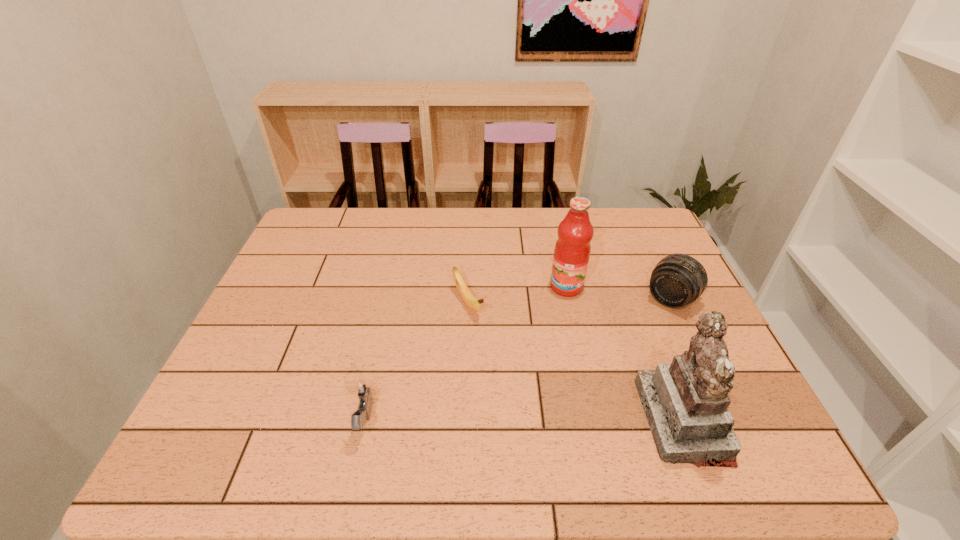
Locate an element on the screen. vacant area between the shortest object and the third tallest object is located at coordinates (569, 301).

Identify the location of object that stands as the third closest to the fruit juice. (686, 402).

I want to click on object that stands as the closest to the figurine, so click(x=677, y=280).

The image size is (960, 540). Identify the location of vacant space that satisfies the following two spatial constraints: 1. on the back side of the figurine; 2. on the front-facing side of the leftmost object. (365, 420).